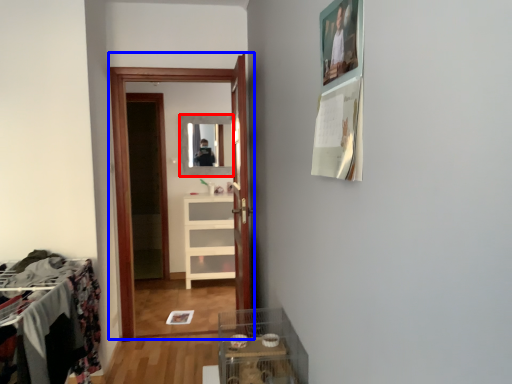
Question: Among these objects, which one is nearest to the camera, mirror (highlighted by a red box) or clothing store (highlighted by a blue box)?

Choices:
 (A) mirror
 (B) clothing store

Answer: (B)